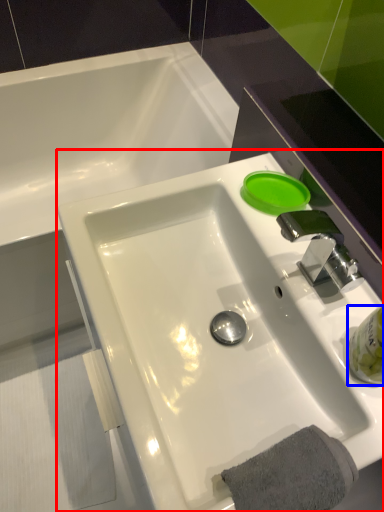
Question: Which point is further to the camera, sink (highlighted by a red box) or liquid (highlighted by a blue box)?

Choices:
 (A) sink
 (B) liquid

Answer: (B)